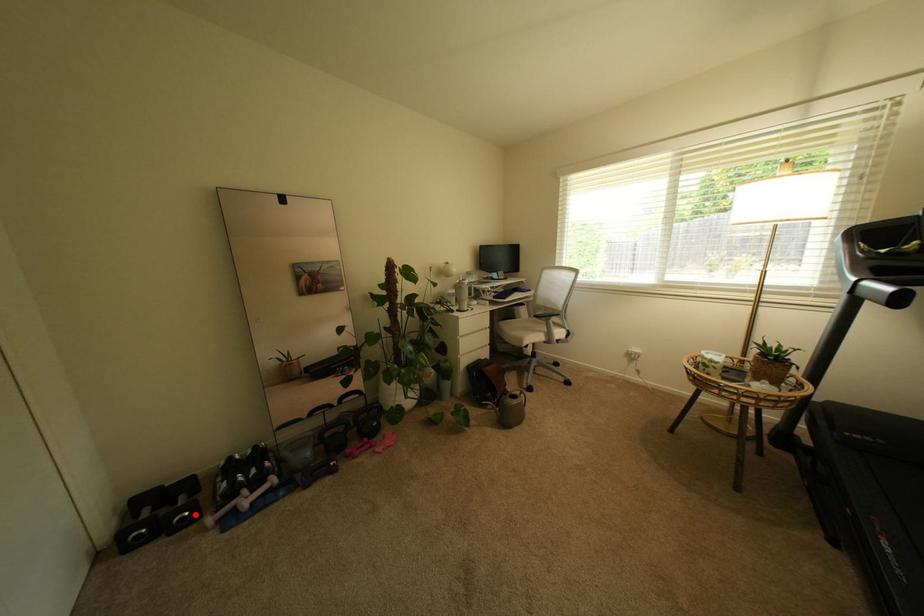
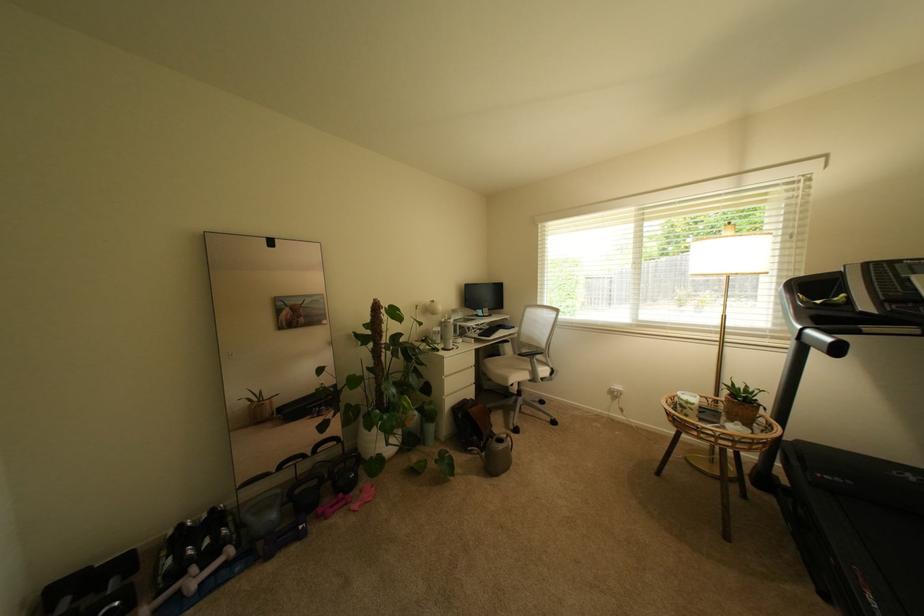
In the second image, find the point that corresponds to the highlighted location in the first image.

(126, 604)